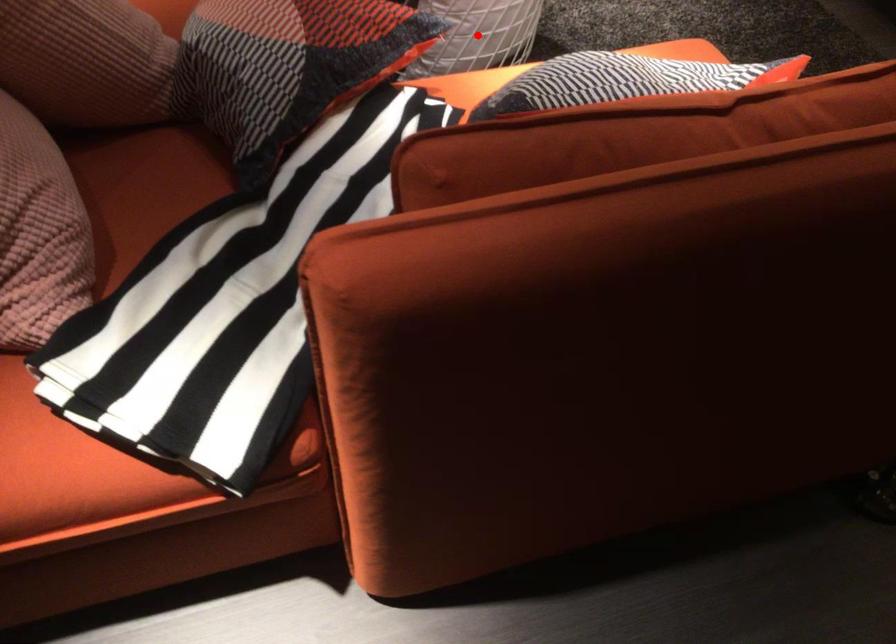
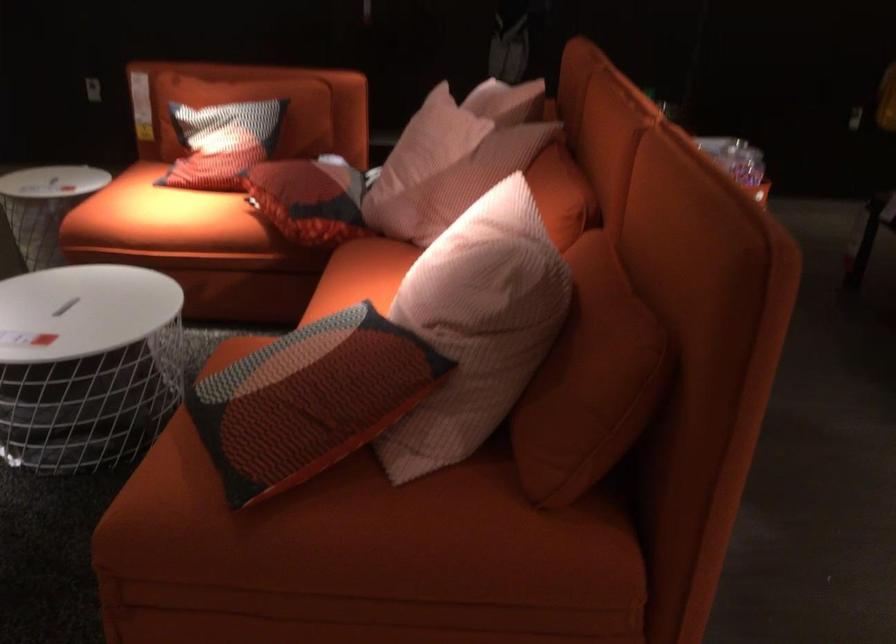
Question: I am providing you with two images of the same scene from different viewpoints. A red point is marked on the first image. Can you still see the location of the red point in image 2?

Choices:
 (A) Yes
 (B) No

Answer: (B)